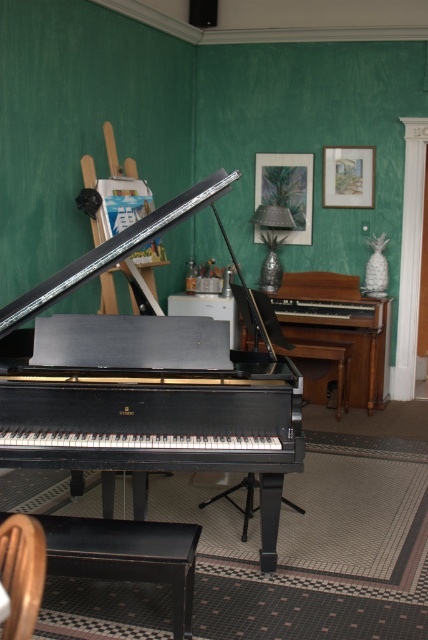
Does shiny black piano at center have a lesser width compared to wooden polished piano at center?

No, shiny black piano at center is not thinner than wooden polished piano at center.

Find the location of a particular element. The image size is (428, 640). shiny black piano at center is located at coordinates (151, 403).

This screenshot has width=428, height=640. Describe the element at coordinates (151, 403) in the screenshot. I see `shiny black piano at center` at that location.

Where is `shiny black piano at center`? This screenshot has height=640, width=428. shiny black piano at center is located at coordinates point(151,403).

Can you confirm if shiny black piano at center is positioned to the left of wooden armchair at lower left?

Incorrect, shiny black piano at center is not on the left side of wooden armchair at lower left.

Can you confirm if shiny black piano at center is taller than wooden armchair at lower left?

Yes.

This screenshot has width=428, height=640. What are the coordinates of `shiny black piano at center` in the screenshot? It's located at (151, 403).

Find the location of `shiny black piano at center`. shiny black piano at center is located at coordinates (151, 403).

Is metallic silver picture frame at upper center closer to the viewer compared to wooden picture frame at upper center?

No, it is behind wooden picture frame at upper center.

The width and height of the screenshot is (428, 640). Describe the element at coordinates (287, 189) in the screenshot. I see `metallic silver picture frame at upper center` at that location.

In order to click on metallic silver picture frame at upper center in this screenshot , I will do `click(287, 189)`.